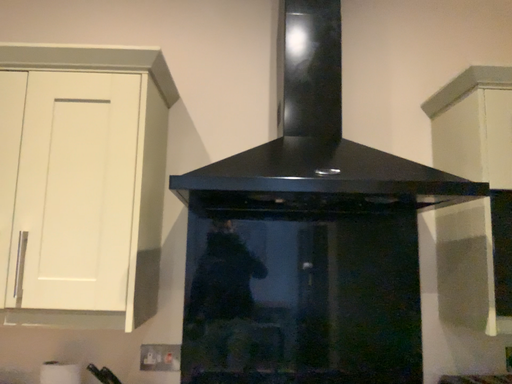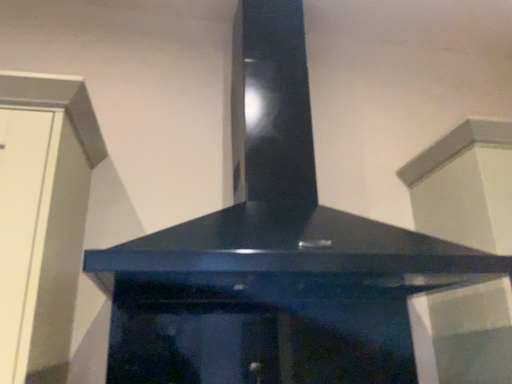
Question: How did the camera likely rotate when shooting the video?

Choices:
 (A) rotated right
 (B) rotated left

Answer: (A)